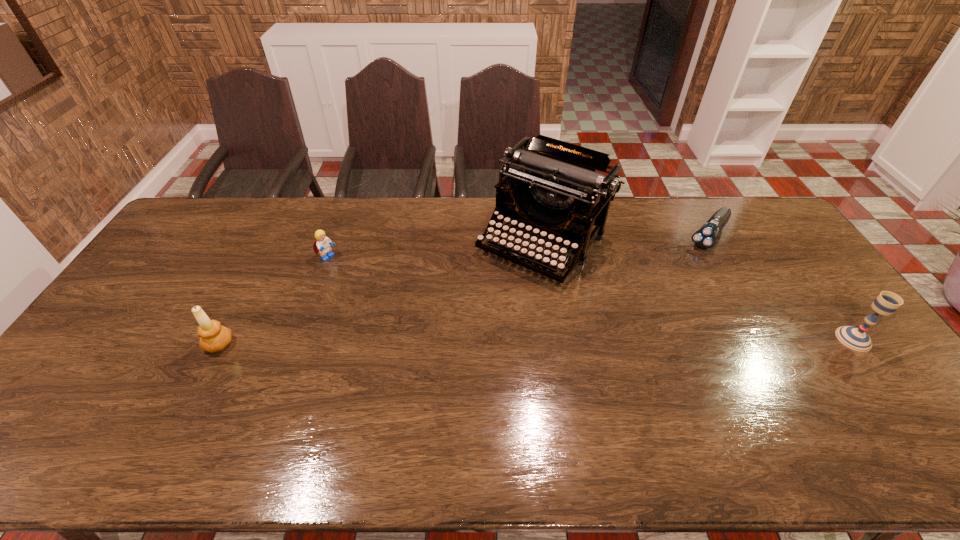
Where is `free spot located 0.230m on the front-facing side of the second shortest object`? Image resolution: width=960 pixels, height=540 pixels. free spot located 0.230m on the front-facing side of the second shortest object is located at coordinates (386, 291).

I want to click on vacant space located on the front-facing side of the second shortest object, so click(345, 268).

This screenshot has height=540, width=960. Identify the location of free location located 0.340m on the front-facing side of the second shortest object. (414, 306).

Find the location of a particular element. This screenshot has height=540, width=960. free point located on the typing side of the typewriter is located at coordinates (466, 335).

Locate an element on the screen. The width and height of the screenshot is (960, 540). vacant space located 0.330m on the typing side of the typewriter is located at coordinates (447, 357).

Find the location of a particular element. This screenshot has width=960, height=540. vacant space located on the typing side of the typewriter is located at coordinates coord(466,335).

Where is `vacant region located 0.240m on the head of the shortest object`? The height and width of the screenshot is (540, 960). vacant region located 0.240m on the head of the shortest object is located at coordinates (669, 288).

Locate an element on the screen. This screenshot has width=960, height=540. free point located 0.400m on the head of the shortest object is located at coordinates (645, 318).

The image size is (960, 540). Identify the location of free spot located on the head of the shortest object. (653, 308).

Find the location of a particular element. typewriter at the far edge is located at coordinates (557, 190).